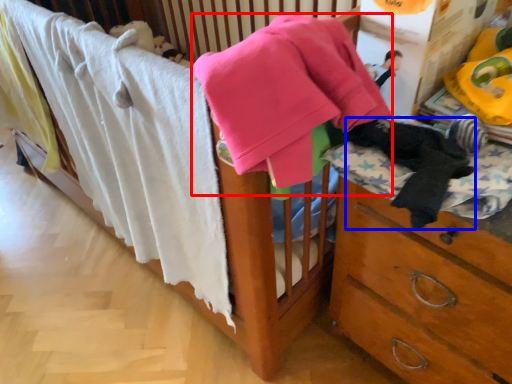
Question: Which of the following is the farthest to the observer, baby clothe (highlighted by a red box) or clothing (highlighted by a blue box)?

Choices:
 (A) baby clothe
 (B) clothing

Answer: (B)